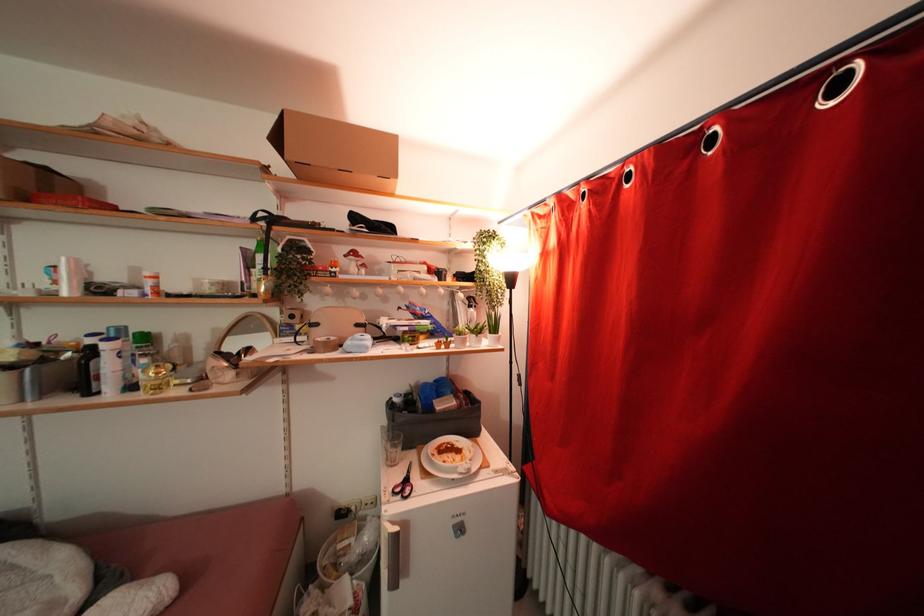
The image size is (924, 616). I want to click on pair of scissors, so click(403, 485).